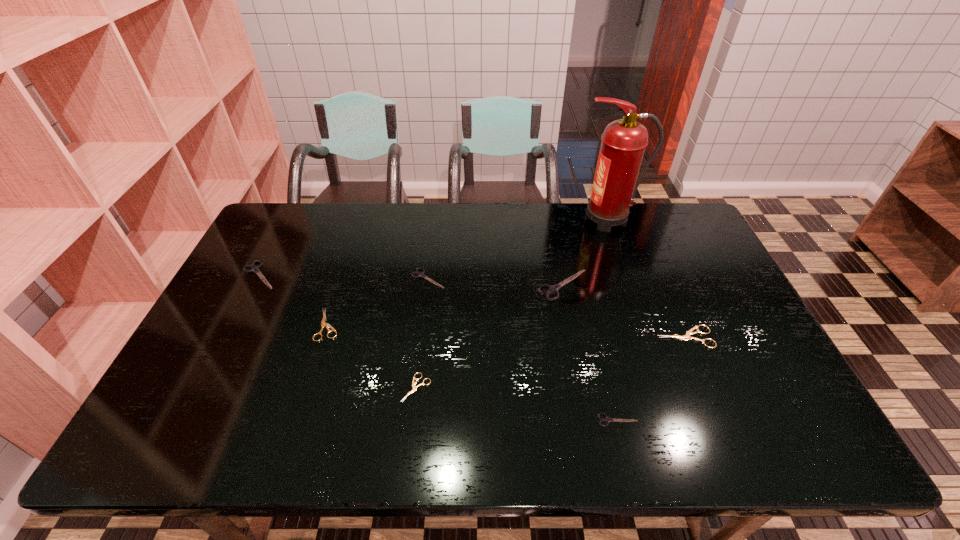
Image resolution: width=960 pixels, height=540 pixels. Identify the location of vacant space at the near edge. (230, 442).

Identify the location of free space at the right edge of the desktop. This screenshot has height=540, width=960. (702, 260).

At what (x,y) coordinates should I click in order to perform the action: click on free space at the near left corner of the desktop. Please return your answer as a coordinate pair (x, y). Image resolution: width=960 pixels, height=540 pixels. Looking at the image, I should click on (167, 422).

What are the coordinates of `free space at the far right corner of the desktop` in the screenshot? It's located at (648, 212).

Find the location of a particular element. Image resolution: width=960 pixels, height=540 pixels. vacant area that lies between the red fire extinguisher and the leftmost beige shears is located at coordinates (468, 272).

This screenshot has width=960, height=540. I want to click on vacant area between the biggest black shears and the farthest object, so click(586, 252).

You are a GUI agent. You are given a task and a screenshot of the screen. Output one action in this format:
    pyautogui.click(x=<x>, y=<y>)
    Task: Click on the unoccupied area between the biggest black shears and the red fire extinguisher
    This screenshot has height=540, width=960.
    Given the screenshot: What is the action you would take?
    (586, 252)

The width and height of the screenshot is (960, 540). What are the coordinates of `free space that is in between the nearest shears and the leftmost beige shears` in the screenshot? It's located at (473, 372).

The image size is (960, 540). What are the coordinates of `free spot between the smallest beige shears and the biggest beige shears` in the screenshot? It's located at (551, 362).

Locate an element on the screen. The height and width of the screenshot is (540, 960). vacant space in between the nearest black shears and the leftmost beige shears is located at coordinates (473, 372).